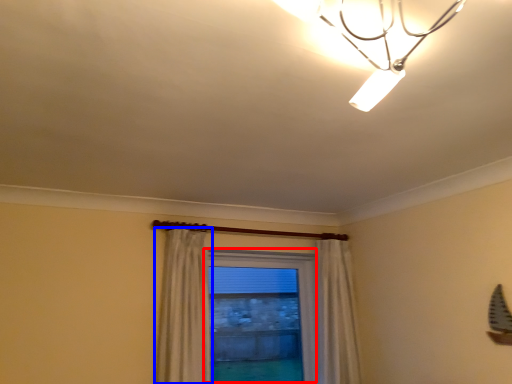
Question: Which object appears closest to the camera in this image, window (highlighted by a red box) or curtain (highlighted by a blue box)?

Choices:
 (A) window
 (B) curtain

Answer: (B)